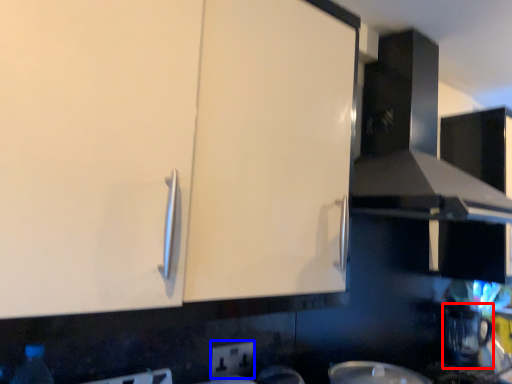
Question: Which object is closer to the camera taking this photo, coffee machine (highlighted by a red box) or electric outlet (highlighted by a blue box)?

Choices:
 (A) coffee machine
 (B) electric outlet

Answer: (B)